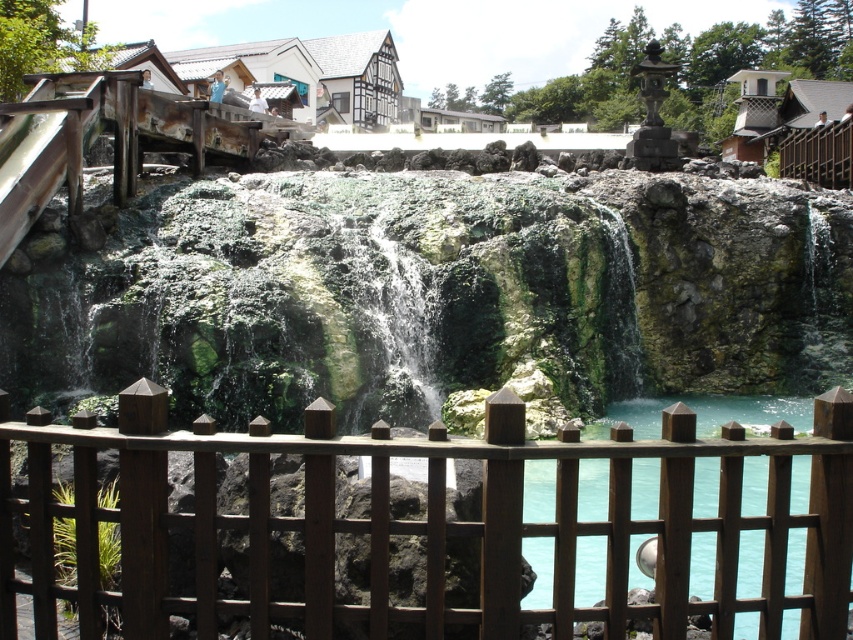
Does brown wooden fence at center have a smaller size compared to turquoise glass water at center?

No, brown wooden fence at center is not smaller than turquoise glass water at center.

Can you confirm if brown wooden fence at center is taller than turquoise glass water at center?

In fact, brown wooden fence at center may be shorter than turquoise glass water at center.

Who is more distant from viewer, (109, 596) or (698, 586)?

The point (698, 586) is more distant.

The width and height of the screenshot is (853, 640). Identify the location of brown wooden fence at center. (431, 520).